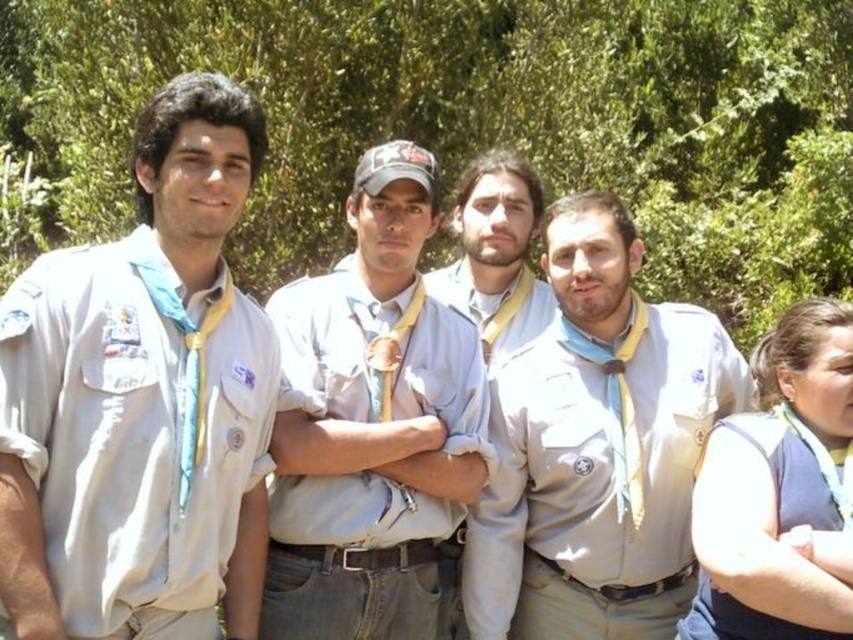
You are a scout leader trying to distribute uniforms to scouts. You have two uniforms available in the image. Which uniform, the matte khaki uniform at center or the light beige uniform at center, is more suitable for a taller scout?

The matte khaki uniform at center is larger in size than the light beige uniform at center, so it is more suitable for a taller scout.

You are a scout leader trying to arrange a formation for a group photo. You see two points marked in the image, point (x=531, y=497) and point (x=787, y=349). Which point is closer to the camera where you are standing?

Point (x=531, y=497) is closer to the camera than point (x=787, y=349) because it is further to the viewer.